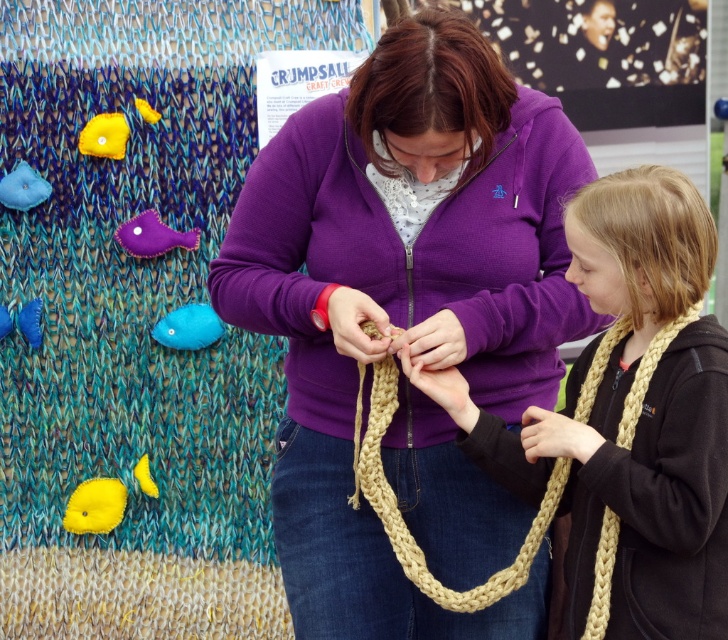
Question: Does beige woven scarf at center have a larger size compared to purple felt fish at left?

Choices:
 (A) no
 (B) yes

Answer: (B)

Question: Does beige braided string at center have a greater width compared to yellow felt fish at lower left?

Choices:
 (A) no
 (B) yes

Answer: (B)

Question: Is purple felt fish at left behind matte blue felt fish at upper left?

Choices:
 (A) no
 (B) yes

Answer: (B)

Question: Which point appears closest to the camera in this image?

Choices:
 (A) (621, 557)
 (B) (154, 116)
 (C) (448, 244)
 (D) (39, 333)

Answer: (A)

Question: Among these points, which one is nearest to the camera?

Choices:
 (A) (7, 179)
 (B) (356, 397)
 (C) (191, 330)
 (D) (3, 308)

Answer: (B)

Question: Estimate the real-world distances between objects in this image. Which object is closer to the beige woven scarf at center?

Choices:
 (A) matte yellow felt fish at lower left
 (B) purple felt fish at left
 (C) yellow felt fish at lower left

Answer: (B)